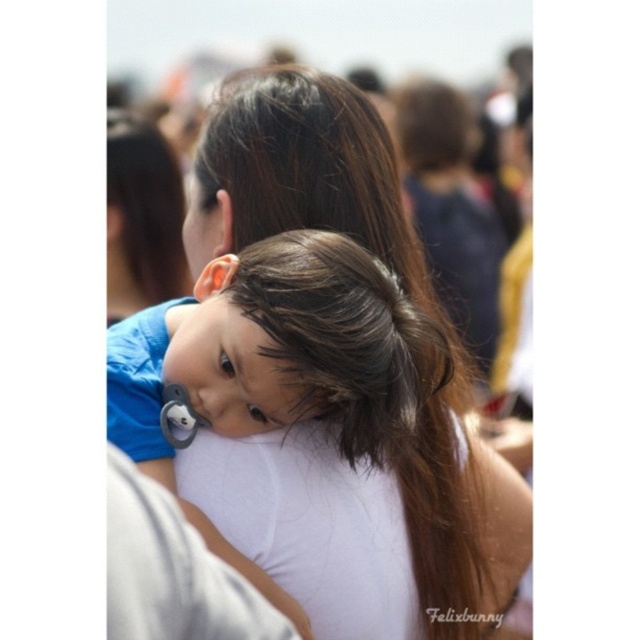
Is brown smooth hair at center smaller than white fabric shoulder at center?

No, brown smooth hair at center is not smaller than white fabric shoulder at center.

Can you confirm if brown smooth hair at center is positioned above white fabric shoulder at center?

Indeed, brown smooth hair at center is positioned over white fabric shoulder at center.

Does point (444, 524) come behind point (116, 529)?

Yes, point (444, 524) is farther from viewer.

I want to click on brown smooth hair at center, so click(374, 396).

Is point (275, 132) behind point (419, 412)?

Yes, point (275, 132) is farther from viewer.

Is the position of white fabric at center less distant than that of brown smooth hair at center?

No, it is not.

You are a GUI agent. You are given a task and a screenshot of the screen. Output one action in this format:
    pyautogui.click(x=<x>, y=<y>)
    Task: Click on the white fabric at center
    The image size is (640, 640).
    Given the screenshot: What is the action you would take?
    pyautogui.click(x=324, y=420)

Find the location of `white fabric at center`. white fabric at center is located at coordinates (324, 420).

Who is more forward, [390,227] or [259,614]?

Point [259,614]

Measure the distance between point (426,595) and camera.

A distance of 10.48 feet exists between point (426,595) and camera.

Locate an element on the screen. The image size is (640, 640). white fabric at center is located at coordinates (324, 420).